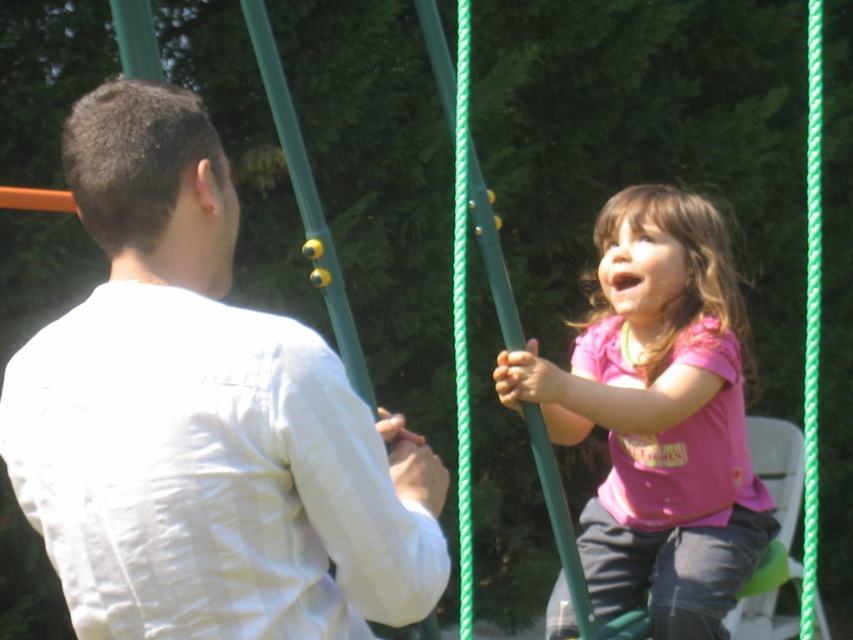
Question: Does white cotton shirt at upper left appear under pink matte shirt at center?

Choices:
 (A) no
 (B) yes

Answer: (A)

Question: Among these points, which one is farthest from the camera?

Choices:
 (A) (254, 456)
 (B) (694, 291)

Answer: (B)

Question: In this image, where is white cotton shirt at upper left located relative to pink matte shirt at center?

Choices:
 (A) right
 (B) left

Answer: (B)

Question: Is white cotton shirt at upper left positioned before pink matte shirt at center?

Choices:
 (A) yes
 (B) no

Answer: (A)

Question: Which object appears closest to the camera in this image?

Choices:
 (A) pink matte shirt at center
 (B) white cotton shirt at upper left

Answer: (B)

Question: Which point is closer to the camera?

Choices:
 (A) (625, 480)
 (B) (212, 444)

Answer: (B)